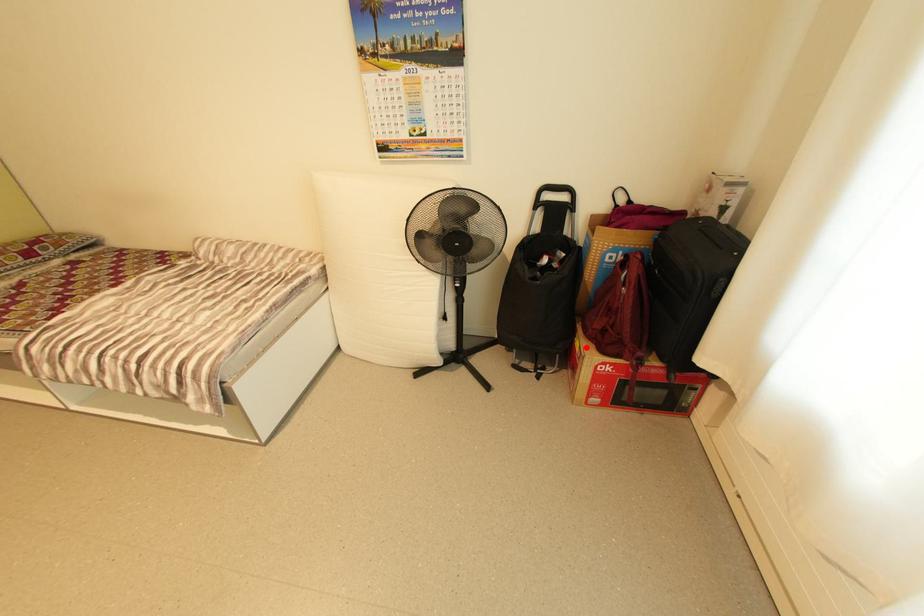
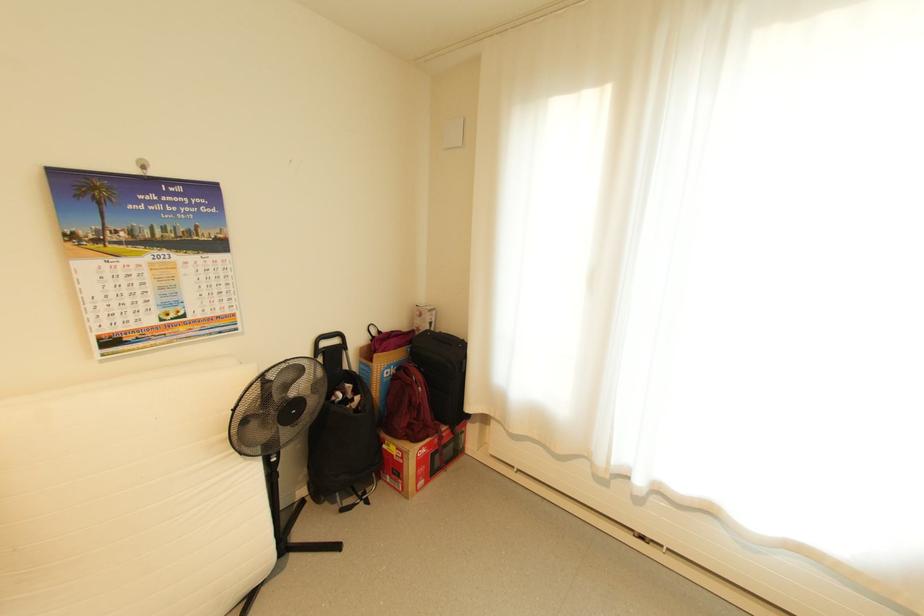
Where in the second image is the point corresponding to the highlighted location from the first image?

(404, 448)